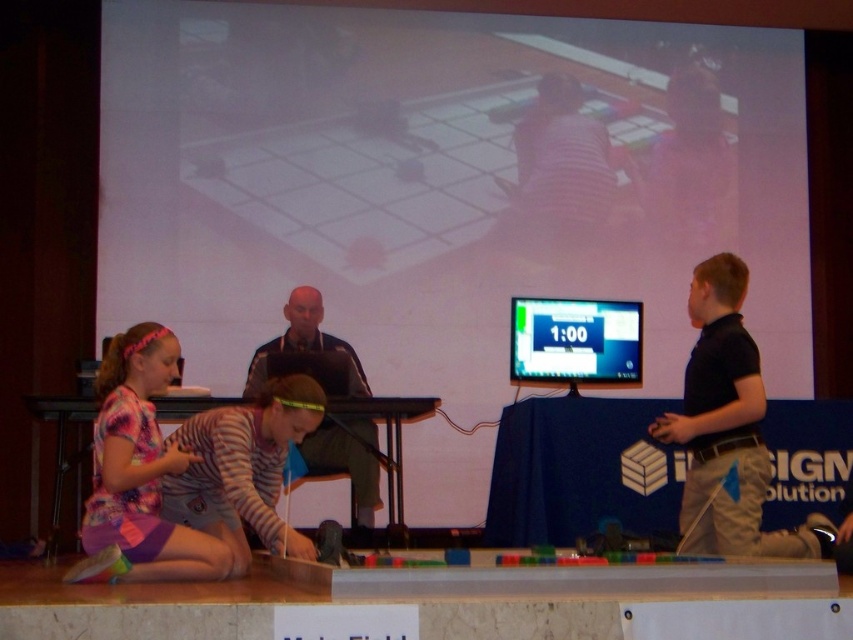
Question: Is printed cotton shirt at lower left thinner than dark gray shirt at center?

Choices:
 (A) yes
 (B) no

Answer: (A)

Question: Can you confirm if striped jersey at lower left is wider than dark gray shirt at center?

Choices:
 (A) no
 (B) yes

Answer: (A)

Question: Which point is closer to the camera?

Choices:
 (A) black cotton shirt at right
 (B) matte black monitor at center
 (C) white matte projection screen at upper center

Answer: (A)

Question: Which object is closer to the camera taking this photo?

Choices:
 (A) black cotton shirt at right
 (B) matte black monitor at center
 (C) dark gray shirt at center
 (D) printed cotton shirt at lower left

Answer: (D)

Question: Which of the following is the farthest from the observer?

Choices:
 (A) black cotton shirt at right
 (B) striped jersey at lower left
 (C) matte black monitor at center

Answer: (C)

Question: Is black cotton shirt at right positioned behind dark gray shirt at center?

Choices:
 (A) no
 (B) yes

Answer: (A)